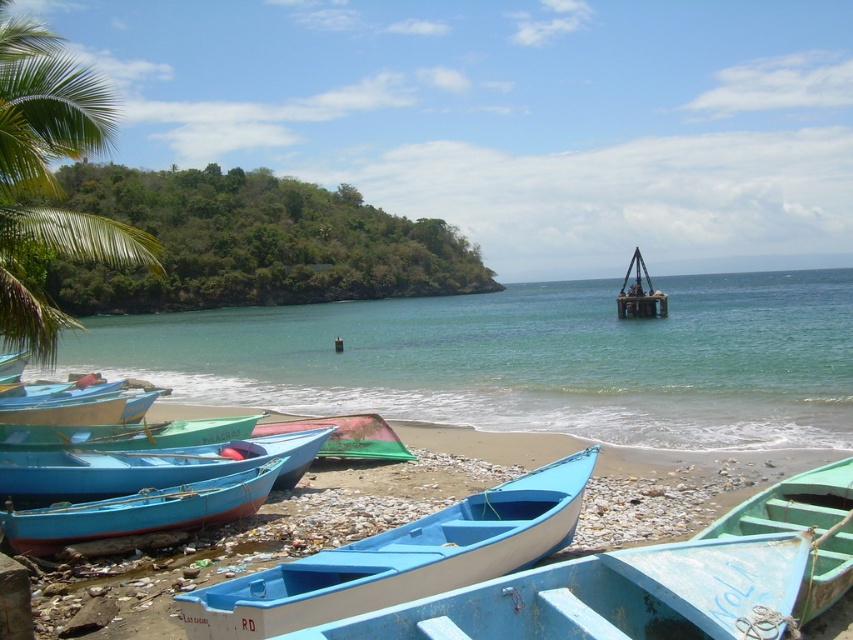
You are standing on the beach and want to take a photo of the matte blue canoe at lower left and the clear blue water at center. Which object should appear in front of the other in your photo?

The clear blue water at center should appear in front of the matte blue canoe at lower left in your photo because the matte blue canoe at lower left is positioned behind the clear blue water at center.

You are standing on the pebbled beach in the coastal scene and want to walk from one point to another. You notice two points marked in the image. Which point is closer to you, point (792,468) or point (86,403)?

Point (792,468) is closer to you than point (86,403).

You are standing on the pebbled beach and want to walk from the blue plastic boats at lower left to the blue painted wooden boat at lower left. Which direction should you move to reach the boat?

The blue plastic boats at lower left is in front of blue painted wooden boat at lower left, so you should move backward to reach the blue painted wooden boat at lower left.